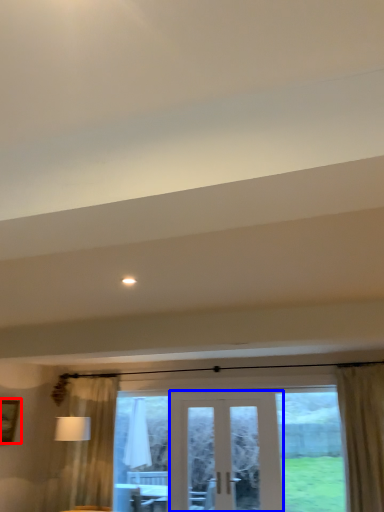
Question: Which point is further to the camera, picture frame (highlighted by a red box) or door (highlighted by a blue box)?

Choices:
 (A) picture frame
 (B) door

Answer: (A)